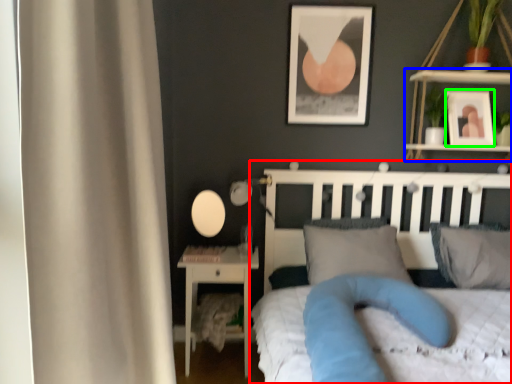
Question: Considering the real-world distances, which object is farthest from bed (highlighted by a red box)? shelf (highlighted by a blue box) or picture frame (highlighted by a green box)?

Choices:
 (A) shelf
 (B) picture frame

Answer: (A)